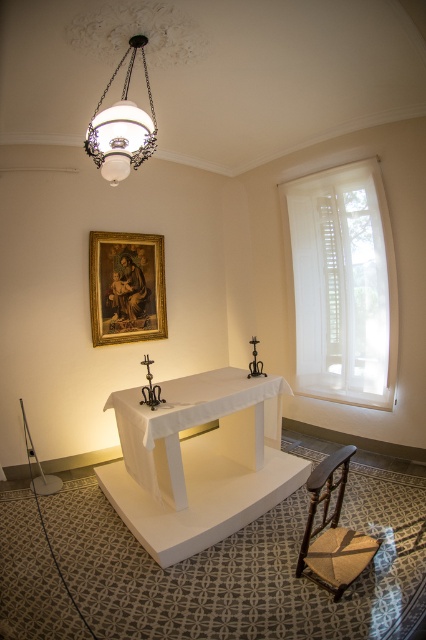
Which of these two, wooden textured stool at lower right or white glass lampshade at upper center, stands taller?

With more height is wooden textured stool at lower right.

In the scene shown: Between wooden textured stool at lower right and white glass lampshade at upper center, which one is positioned higher?

Positioned higher is white glass lampshade at upper center.

This screenshot has height=640, width=426. Find the location of `wooden textured stool at lower right`. wooden textured stool at lower right is located at coordinates (333, 531).

Can you confirm if white sheer curtain at right is wider than white glass lampshade at upper center?

Indeed, white sheer curtain at right has a greater width compared to white glass lampshade at upper center.

From the picture: Between white sheer curtain at right and white glass lampshade at upper center, which one has less height?

white glass lampshade at upper center

I want to click on white sheer curtain at right, so click(342, 284).

Who is lower down, white matte table at center or gold-framed painting at upper center?

Positioned lower is white matte table at center.

Which is more to the right, white matte table at center or gold-framed painting at upper center?

white matte table at center

Which is behind, point (270, 404) or point (109, 333)?

The point (109, 333) is behind.

Where is `white matte table at center`? white matte table at center is located at coordinates (195, 424).